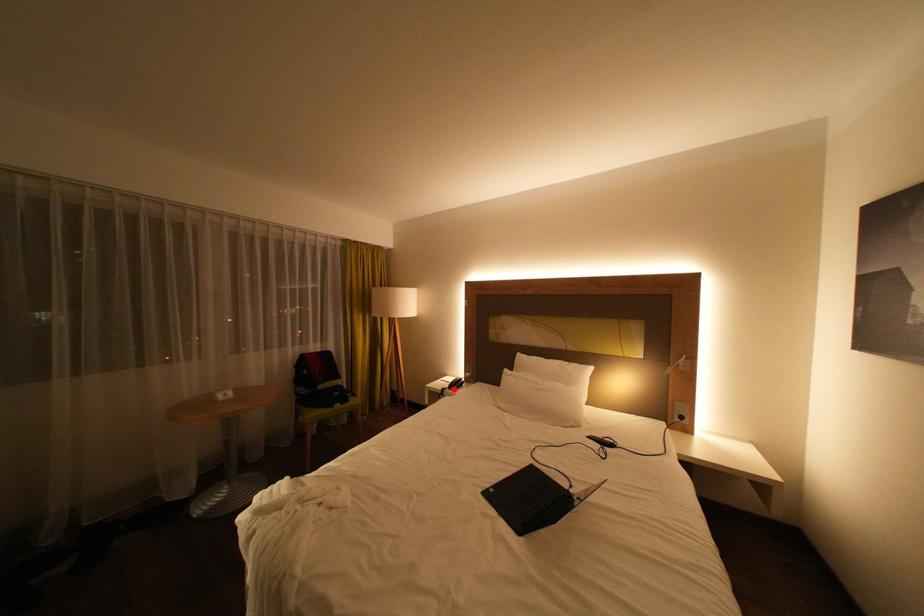
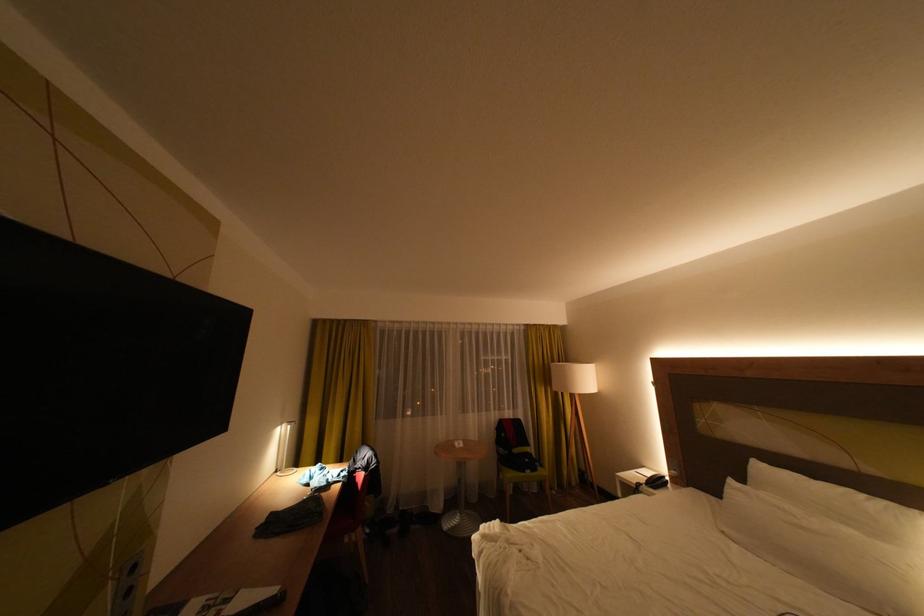
Question: I am providing you with two images of the same scene from different viewpoints. In image1, a red point is highlighted. Considering the same 3D point in image2, which of the following is correct?

Choices:
 (A) It is closer
 (B) It is farther

Answer: (A)